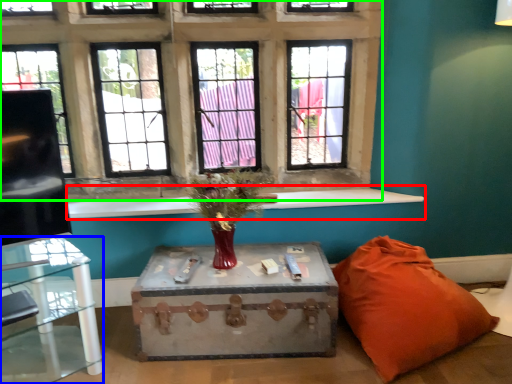
Question: Based on their relative distances, which object is farther from window sill (highlighted by a red box)? Choose from table (highlighted by a blue box) and window (highlighted by a green box).

Choices:
 (A) table
 (B) window

Answer: (B)